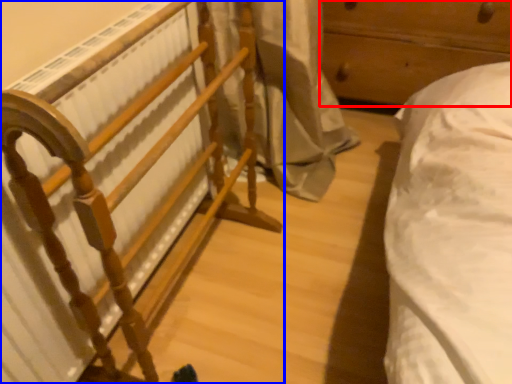
Question: Which object appears closest to the camera in this image, furniture (highlighted by a red box) or furniture (highlighted by a blue box)?

Choices:
 (A) furniture
 (B) furniture

Answer: (B)